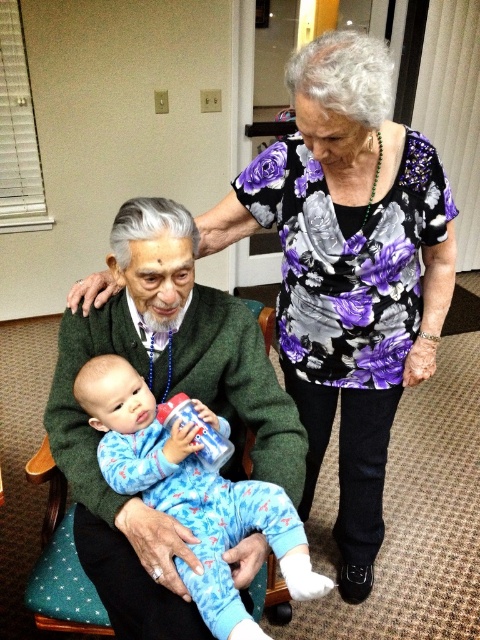
Is point (360, 518) closer to camera compared to point (298, 582)?

No, (360, 518) is behind (298, 582).

Which is in front, point (290, 240) or point (105, 387)?

Positioned in front is point (105, 387).

Is point (372, 61) less distant than point (144, 442)?

Yes, point (372, 61) is in front of point (144, 442).

The height and width of the screenshot is (640, 480). In order to click on floral-patterned blouse at upper center in this screenshot , I will do `click(348, 269)`.